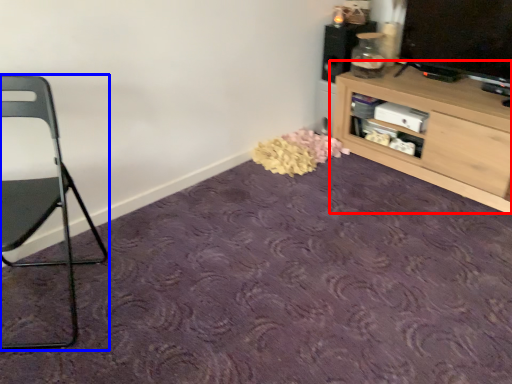
Question: Which object is closer to the camera taking this photo, shelf (highlighted by a red box) or chair (highlighted by a blue box)?

Choices:
 (A) shelf
 (B) chair

Answer: (B)